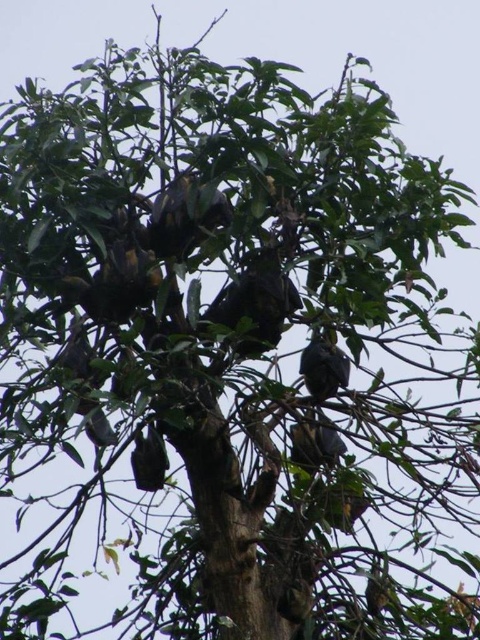
Does dark brown fur bat at center have a lesser height compared to dark gray fur bat at center?

No.

Is dark brown fur bat at center to the right of dark gray fur bat at center from the viewer's perspective?

In fact, dark brown fur bat at center is to the left of dark gray fur bat at center.

At what (x,y) coordinates should I click in order to perform the action: click on dark brown fur bat at center. Please return your answer as a coordinate pair (x, y). This screenshot has width=480, height=640. Looking at the image, I should click on (256, 301).

Locate an element on the screen. This screenshot has width=480, height=640. dark brown fur bat at center is located at coordinates (256, 301).

Is point (319, 385) positioned behind point (320, 452)?

No, (319, 385) is closer to viewer.

How far apart are dark gray fur bat at center and dark gray feathers at center?

dark gray fur bat at center is 4.82 inches from dark gray feathers at center.

Measure the distance between dark gray fur bat at center and camera.

dark gray fur bat at center is 9.30 feet away from camera.

Locate an element on the screen. dark gray fur bat at center is located at coordinates (324, 365).

Can you confirm if dark brown fur bat at center is thinner than dark gray feathers at center?

No, dark brown fur bat at center is not thinner than dark gray feathers at center.

Which of these two, dark brown fur bat at center or dark gray feathers at center, stands shorter?

dark gray feathers at center is shorter.

Is point (247, 296) behind point (315, 428)?

No, (247, 296) is closer to viewer.

This screenshot has height=640, width=480. In order to click on dark brown fur bat at center in this screenshot , I will do [x=256, y=301].